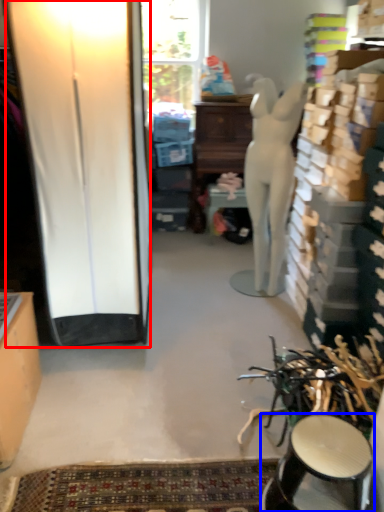
Question: Among these objects, which one is farthest to the camera, screen door (highlighted by a red box) or stool (highlighted by a blue box)?

Choices:
 (A) screen door
 (B) stool

Answer: (A)